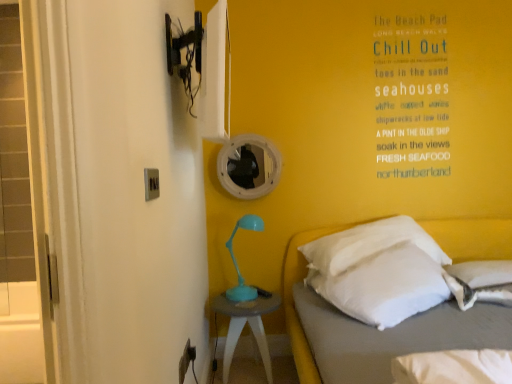
Locate an element on the screen. The height and width of the screenshot is (384, 512). free spot below teal plastic table lamp at center (from a real-world perspective) is located at coordinates (240, 293).